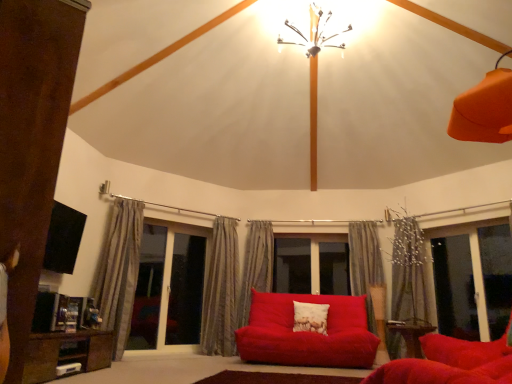
Question: From a real-world perspective, is white textured pillow at center physically located above or below transparent glass screen door at left, the second screen door when ordered from right to left?

Choices:
 (A) above
 (B) below

Answer: (B)

Question: Visually, is white textured pillow at center positioned to the left or to the right of transparent glass screen door at left, the first screen door viewed from the left?

Choices:
 (A) right
 (B) left

Answer: (A)

Question: Which object is the farthest from the transparent glass screen door at lower left, the first screen door viewed from the right?

Choices:
 (A) velvet red studio couch at center
 (B) metallic chandelier at upper center
 (C) silky beige curtain at center, which appears as the 4th curtain when viewed from the right
 (D) transparent glass window at center
 (E) silky gray curtain at right, the first curtain viewed from the right

Answer: (D)

Question: Which of these objects is positioned closest to the transparent glass window at center?

Choices:
 (A) transparent glass screen door at lower left, the first screen door viewed from the right
 (B) brown wood entertainment unit at left
 (C) gray textured curtain at left, the 5th curtain from the right
 (D) metallic chandelier at upper center
 (E) velvet red studio couch at center

Answer: (E)